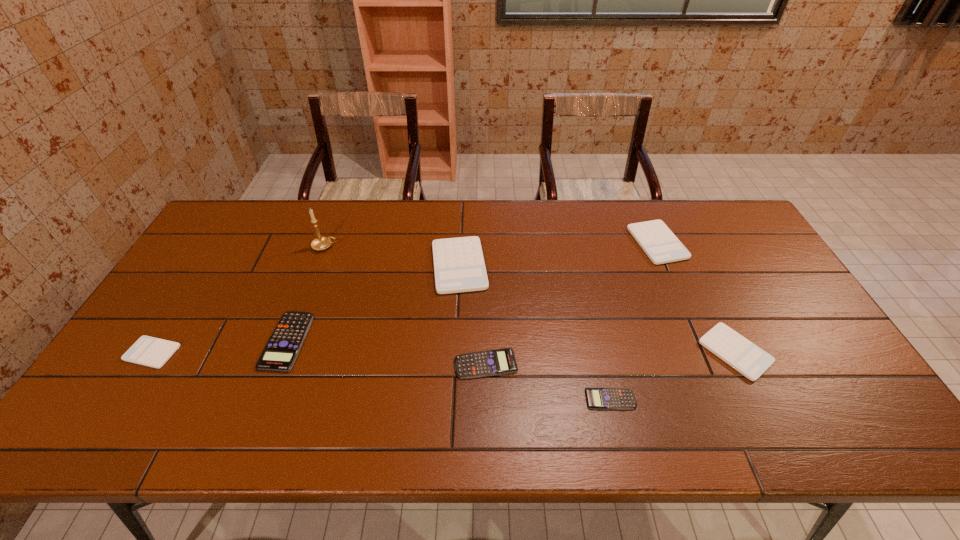
Image resolution: width=960 pixels, height=540 pixels. What are the coordinates of `free region at the left edge` in the screenshot? It's located at (155, 335).

Locate an element on the screen. The width and height of the screenshot is (960, 540). vacant area at the right edge is located at coordinates (761, 300).

This screenshot has height=540, width=960. In order to click on free region at the far left corner of the desktop in this screenshot , I will do `click(241, 240)`.

Image resolution: width=960 pixels, height=540 pixels. In the image, there is a desktop. In order to click on free space at the far right corner in this screenshot , I will do `click(732, 235)`.

You are a GUI agent. You are given a task and a screenshot of the screen. Output one action in this format:
    pyautogui.click(x=<x>, y=<y>)
    Task: Click on the free space between the nearest blue calculator and the second blue calculator from left to right
    
    Given the screenshot: What is the action you would take?
    pyautogui.click(x=548, y=381)

Find the location of a particular element. vacant space in between the fifth calculator from left to right and the second tallest calculator is located at coordinates (634, 321).

Identify the location of free space between the smallest white calculator and the second tallest object. (305, 309).

Where is `free space between the tallest calculator and the nearest calculator`? Image resolution: width=960 pixels, height=540 pixels. free space between the tallest calculator and the nearest calculator is located at coordinates (535, 333).

Locate an element on the screen. The height and width of the screenshot is (540, 960). free spot between the second shortest calculator and the leftmost blue calculator is located at coordinates (386, 353).

The image size is (960, 540). Find the location of `vacant region between the shortest object and the fourth tallest object`. vacant region between the shortest object and the fourth tallest object is located at coordinates (673, 375).